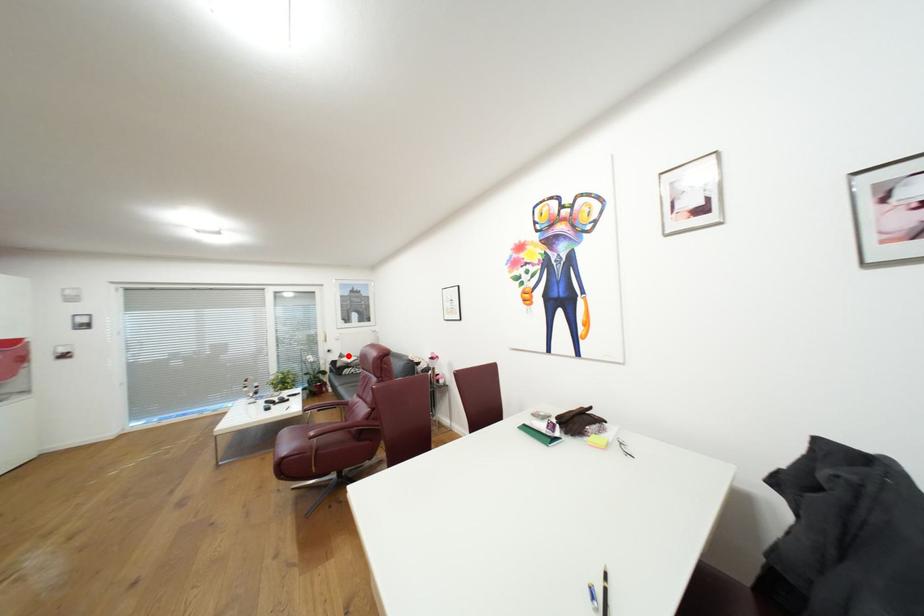
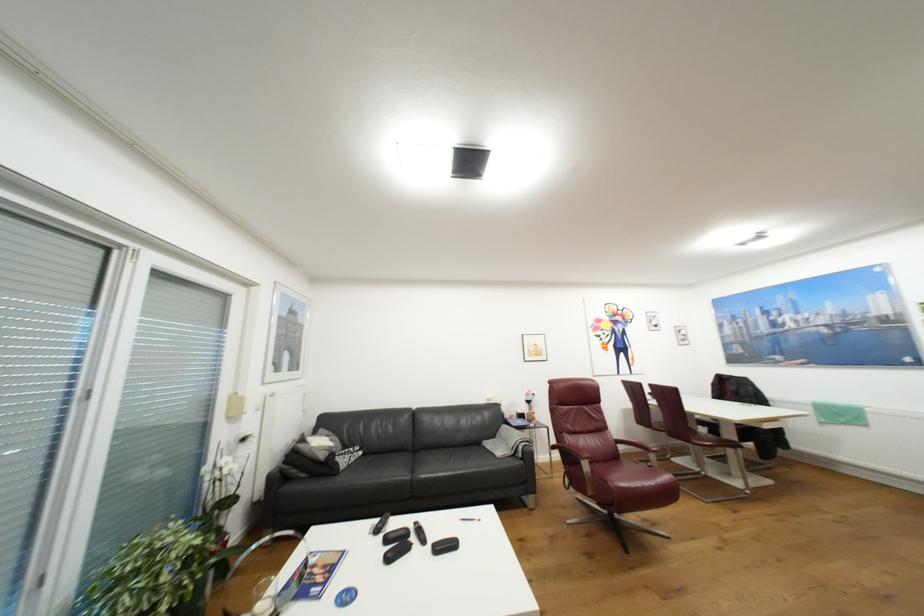
Question: I am providing you with two images of the same scene from different viewpoints. Image1 has a red point marked. In image2, the corresponding 3D location appears at what relative position? Reply with the corresponding letter.

Choices:
 (A) Closer
 (B) Farther

Answer: (A)